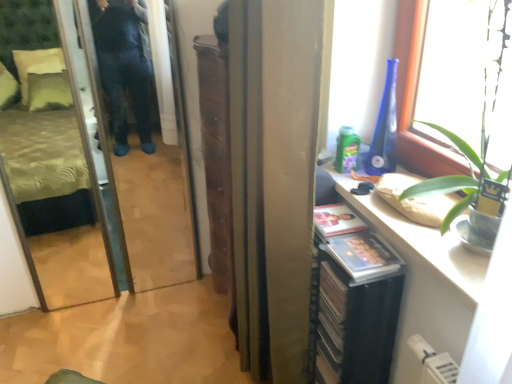
Find the location of a particular element. transparent glass window at upper right is located at coordinates (415, 95).

Where is `transparent glass screen door at left`? This screenshot has width=512, height=384. transparent glass screen door at left is located at coordinates (146, 141).

In the image, is transparent glass screen door at left positioned in front of or behind transparent glass window at upper right?

Visually, transparent glass screen door at left is located behind transparent glass window at upper right.

Is transparent glass screen door at left oriented towards transparent glass window at upper right?

No, transparent glass screen door at left is not facing towards transparent glass window at upper right.

Can you confirm if transparent glass screen door at left is smaller than transparent glass window at upper right?

Incorrect, transparent glass screen door at left is not smaller in size than transparent glass window at upper right.

Can you confirm if transparent glass screen door at left is taller than transparent glass window at upper right?

Yes.

Based on their positions, is transparent glass window at upper right located to the left or right of satin gold curtain at center?

transparent glass window at upper right is to the right of satin gold curtain at center.

From the image's perspective, between transparent glass window at upper right and satin gold curtain at center, which one is located above?

transparent glass window at upper right.

Is transparent glass window at upper right looking in the opposite direction of satin gold curtain at center?

No.

In the scene shown: Considering the sizes of objects transparent glass window at upper right and satin gold curtain at center in the image provided, who is taller, transparent glass window at upper right or satin gold curtain at center?

Standing taller between the two is satin gold curtain at center.

Is satin gold curtain at center not inside transparent glass window at upper right?

Yes, satin gold curtain at center is outside of transparent glass window at upper right.

From the picture: Visually, is satin gold curtain at center positioned to the left or to the right of transparent glass window at upper right?

Based on their positions, satin gold curtain at center is located to the left of transparent glass window at upper right.

Based on their sizes in the image, would you say satin gold curtain at center is bigger or smaller than transparent glass window at upper right?

Considering their sizes, satin gold curtain at center takes up more space than transparent glass window at upper right.

I want to click on screen door above the transparent glass window at upper right (from the image's perspective), so (146, 141).

Which of these two, transparent glass window at upper right or transparent glass screen door at left, is bigger?

Bigger between the two is transparent glass screen door at left.

Can you tell me how much transparent glass window at upper right and transparent glass screen door at left differ in facing direction?

The angular difference between transparent glass window at upper right and transparent glass screen door at left is 91.7 degrees.

Is satin gold curtain at center spatially inside transparent glass screen door at left, or outside of it?

satin gold curtain at center is outside transparent glass screen door at left.

Is satin gold curtain at center far from transparent glass screen door at left?

They are positioned close to each other.

Between satin gold curtain at center and transparent glass screen door at left, which one has less height?

satin gold curtain at center.

From the image's perspective, is satin gold curtain at center located beneath transparent glass screen door at left?

Yes, from the image's perspective, satin gold curtain at center is beneath transparent glass screen door at left.

Is transparent glass screen door at left far from satin gold curtain at center?

Actually, transparent glass screen door at left and satin gold curtain at center are a little close together.

Considering the positions of objects transparent glass screen door at left and satin gold curtain at center in the image provided, who is more to the left, transparent glass screen door at left or satin gold curtain at center?

transparent glass screen door at left.

Does transparent glass screen door at left have a greater width compared to satin gold curtain at center?

In fact, transparent glass screen door at left might be narrower than satin gold curtain at center.

How different are the orientations of transparent glass screen door at left and satin gold curtain at center in degrees?

The angular difference between transparent glass screen door at left and satin gold curtain at center is 91.4 degrees.

At what (x,y) coordinates should I click in order to perform the action: click on window that appears in front of the transparent glass screen door at left. Please return your answer as a coordinate pair (x, y). Looking at the image, I should click on (415, 95).

You are a GUI agent. You are given a task and a screenshot of the screen. Output one action in this format:
    pyautogui.click(x=<x>, y=<y>)
    Task: Click on the curtain lying behind the transparent glass window at upper right
    The width and height of the screenshot is (512, 384).
    Given the screenshot: What is the action you would take?
    [274, 178]

Considering their positions, is satin gold curtain at center positioned further to transparent glass window at upper right than transparent glass screen door at left?

Based on the image, transparent glass screen door at left appears to be further to transparent glass window at upper right.

From the image, which object appears to be farther from transparent glass screen door at left, transparent glass window at upper right or satin gold curtain at center?

transparent glass window at upper right lies further to transparent glass screen door at left than the other object.

Estimate the real-world distances between objects in this image. Which object is further from transparent glass window at upper right, transparent glass screen door at left or satin gold curtain at center?

transparent glass screen door at left is positioned further to the anchor transparent glass window at upper right.

Estimate the real-world distances between objects in this image. Which object is closer to satin gold curtain at center, transparent glass window at upper right or transparent glass screen door at left?

transparent glass window at upper right.

When comparing their distances from transparent glass screen door at left, does satin gold curtain at center or transparent glass window at upper right seem further?

transparent glass window at upper right is further to transparent glass screen door at left.

Looking at the image, which one is located closer to satin gold curtain at center, transparent glass screen door at left or transparent glass window at upper right?

transparent glass window at upper right lies closer to satin gold curtain at center than the other object.

Locate an element on the screen. This screenshot has height=384, width=512. curtain between transparent glass screen door at left and transparent glass window at upper right from left to right is located at coordinates (274, 178).